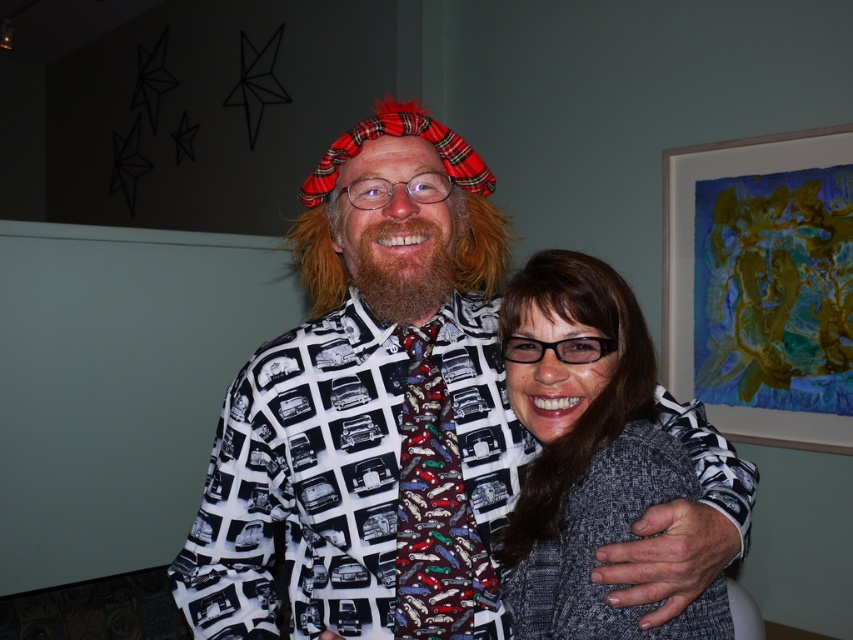
Question: Does printed fabric shirt at center come in front of brownwool-likebeard at center?

Choices:
 (A) no
 (B) yes

Answer: (B)

Question: Among these objects, which one is farthest from the camera?

Choices:
 (A) gray knitted sweater at center
 (B) printed fabric shirt at center
 (C) brownwool-likebeard at center

Answer: (C)

Question: Is gray knitted sweater at center to the left of brownwool-likebeard at center from the viewer's perspective?

Choices:
 (A) yes
 (B) no

Answer: (B)

Question: Which point is farther from the camera taking this photo?

Choices:
 (A) (335, 234)
 (B) (283, 339)
 (C) (554, 333)

Answer: (B)

Question: Which of the following is the closest to the observer?

Choices:
 (A) (418, 177)
 (B) (628, 346)

Answer: (B)

Question: Is the position of printed fabric shirt at center more distant than that of brownwool-likebeard at center?

Choices:
 (A) no
 (B) yes

Answer: (A)